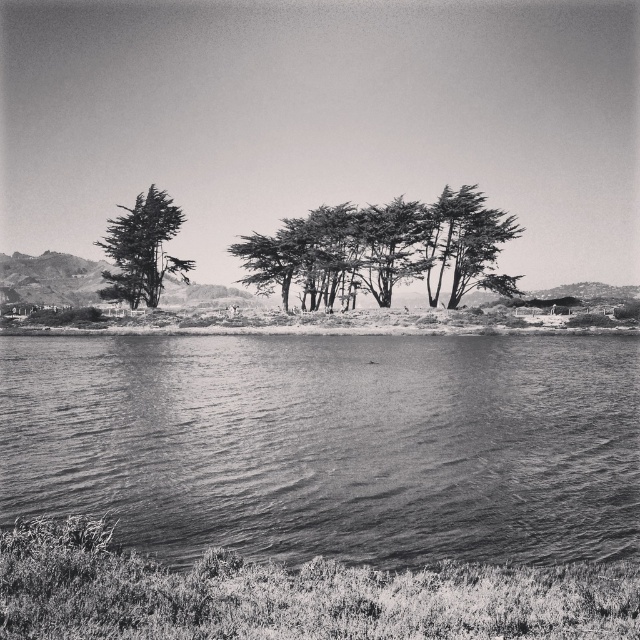
Question: Which object is the farthest from the smooth bark tree at left?

Choices:
 (A) smooth bark trees at center
 (B) smooth water at lower center

Answer: (B)

Question: Observing the image, what is the correct spatial positioning of smooth bark trees at center in reference to smooth bark tree at left?

Choices:
 (A) below
 (B) above

Answer: (B)

Question: Is smooth water at lower center further to the viewer compared to smooth bark trees at center?

Choices:
 (A) yes
 (B) no

Answer: (B)

Question: Which object is positioned farthest from the smooth bark tree at left?

Choices:
 (A) smooth water at lower center
 (B) smooth bark trees at center

Answer: (A)

Question: Can you confirm if smooth bark trees at center is positioned to the left of smooth bark tree at left?

Choices:
 (A) yes
 (B) no

Answer: (B)

Question: Which object is positioned farthest from the smooth bark trees at center?

Choices:
 (A) smooth bark tree at left
 (B) smooth water at lower center

Answer: (B)